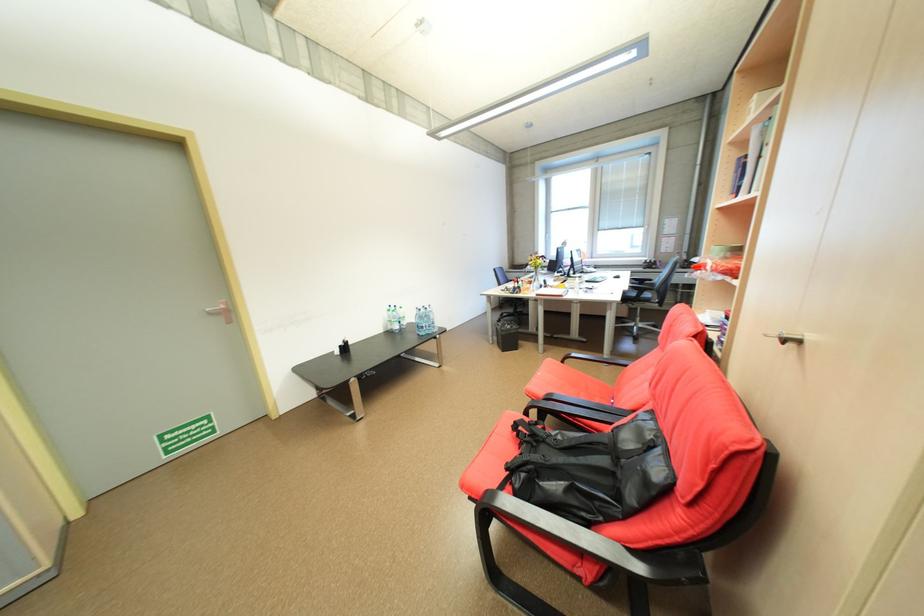
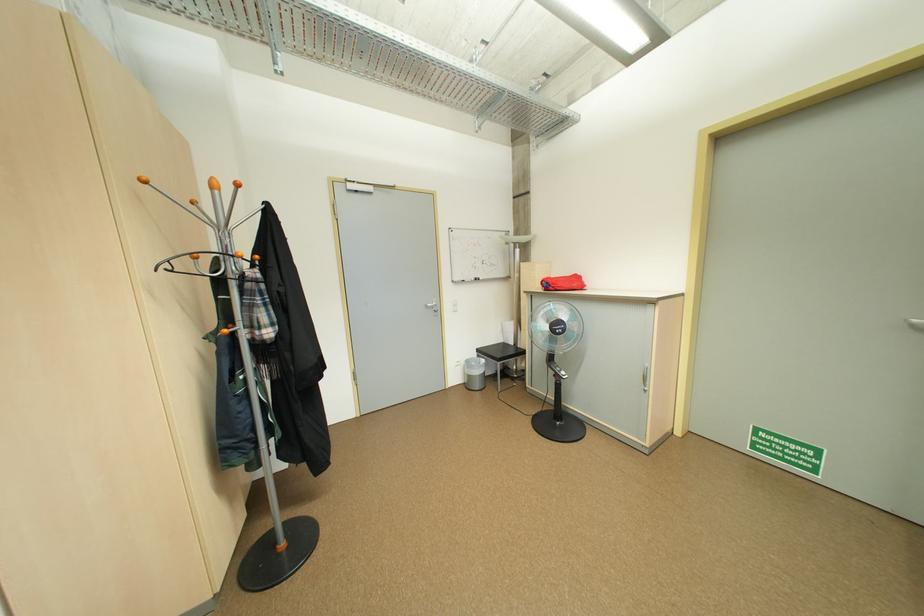
Based on the continuous images, in which direction is the camera rotating?

The camera's rotation is toward left-down.